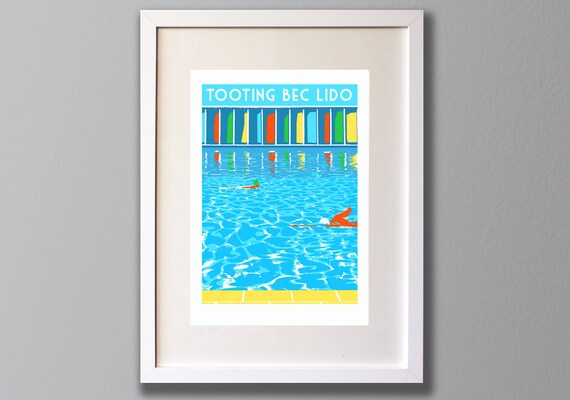
This screenshot has width=570, height=400. What are the coordinates of `picture` in the screenshot? It's located at (264, 221).